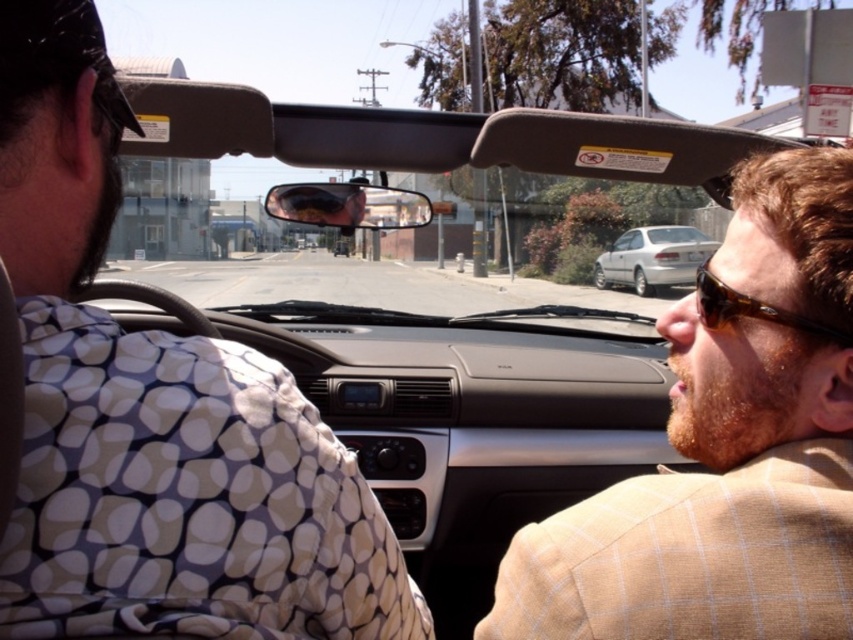
Does beige textured blazer at left appear on the right side of brown tortoiseshell sunglasses at right?

Incorrect, beige textured blazer at left is not on the right side of brown tortoiseshell sunglasses at right.

Is beige textured blazer at left shorter than brown tortoiseshell sunglasses at right?

Incorrect, beige textured blazer at left's height does not fall short of brown tortoiseshell sunglasses at right's.

Describe the element at coordinates (155, 413) in the screenshot. The width and height of the screenshot is (853, 640). I see `beige textured blazer at left` at that location.

The height and width of the screenshot is (640, 853). Identify the location of beige textured blazer at left. (155, 413).

Between point (665, 284) and point (738, 307), which one is positioned behind?

Point (665, 284)

Can you confirm if silver metallic sedan at center is smaller than brown tortoiseshell sunglasses at right?

Incorrect, silver metallic sedan at center is not smaller in size than brown tortoiseshell sunglasses at right.

The height and width of the screenshot is (640, 853). I want to click on silver metallic sedan at center, so click(x=653, y=259).

The width and height of the screenshot is (853, 640). Find the location of `silver metallic sedan at center`. silver metallic sedan at center is located at coordinates (653, 259).

Is brown checkered suit at right wider than silver metallic sedan at center?

No.

Is point (780, 324) positioned after point (693, 259)?

No, it is not.

Does point (840, 506) lie behind point (635, 253)?

No, (840, 506) is closer to viewer.

This screenshot has width=853, height=640. I want to click on brown checkered suit at right, so click(726, 449).